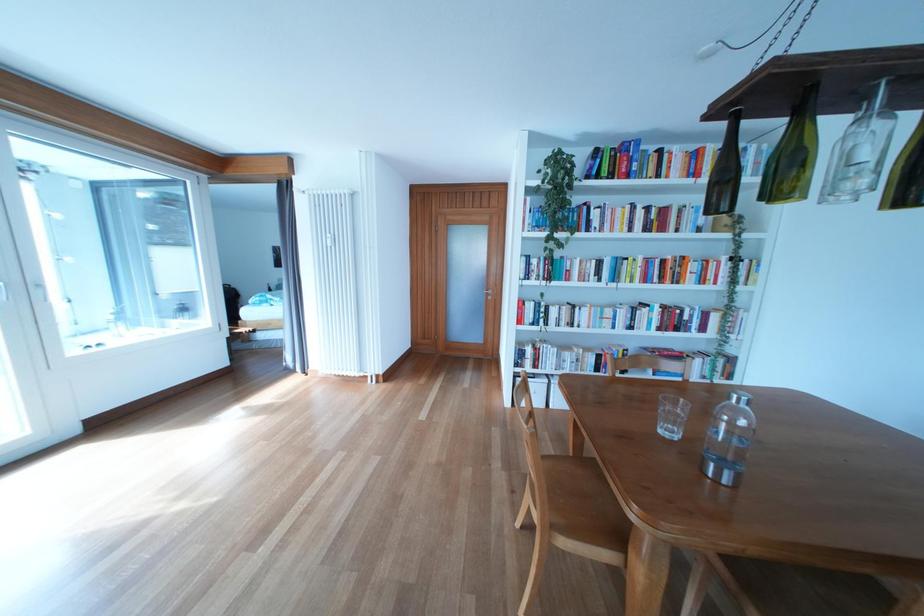
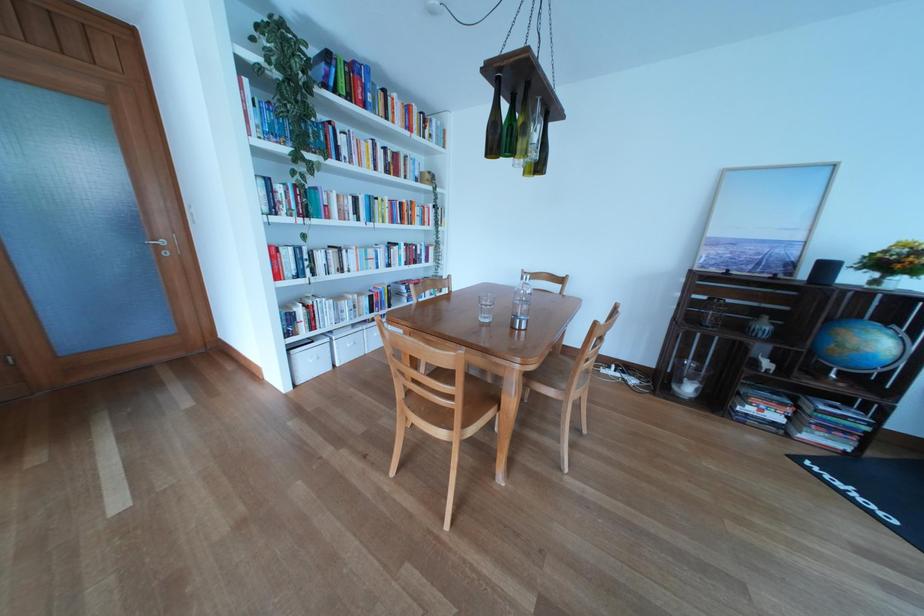
Where in the second image is the point corresponding to (640,180) from the first image?

(378, 111)